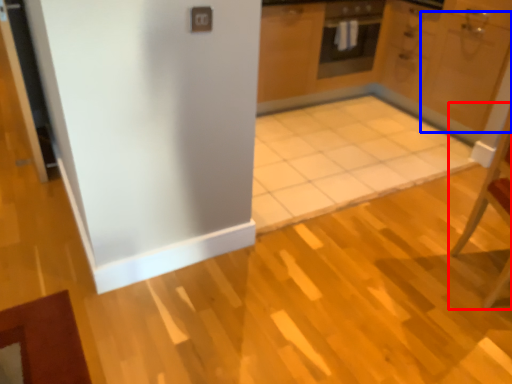
Question: Among these objects, which one is farthest to the camera, chair (highlighted by a red box) or door (highlighted by a blue box)?

Choices:
 (A) chair
 (B) door

Answer: (B)